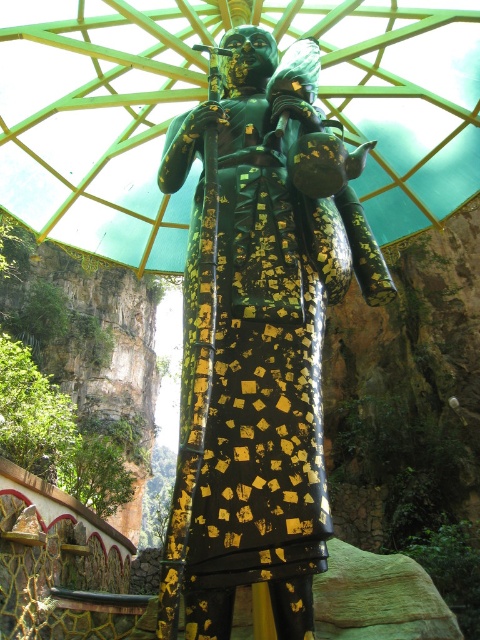
Where is `gold leafed statue at center`? The image size is (480, 640). gold leafed statue at center is located at coordinates (262, 333).

Which is more to the left, gold leafed statue at center or green glossy umbrella at center?

green glossy umbrella at center

Which is in front, point (216, 611) or point (107, 180)?

Point (216, 611) is in front.

You are a GUI agent. You are given a task and a screenshot of the screen. Output one action in this format:
    pyautogui.click(x=<x>, y=<y>)
    Task: Click on the gold leafed statue at center
    
    Given the screenshot: What is the action you would take?
    pyautogui.click(x=262, y=333)